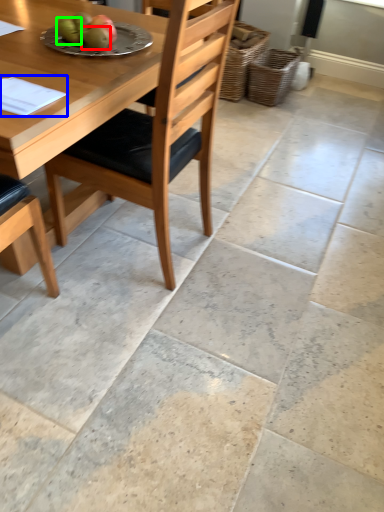
Question: Which object is positioned farthest from fruit (highlighted by a red box)? Select from notepad (highlighted by a blue box) and fruit (highlighted by a green box).

Choices:
 (A) notepad
 (B) fruit

Answer: (A)